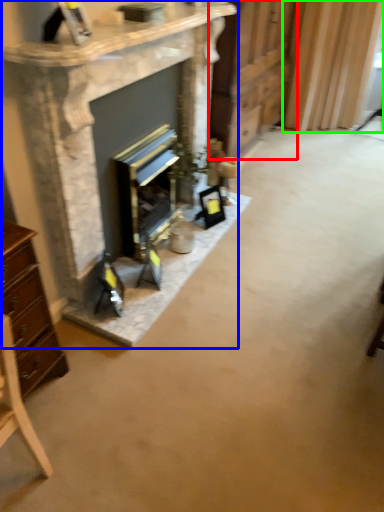
Question: Estimate the real-world distances between objects in this image. Which object is closer to dresser (highlighted by a red box), fireplace (highlighted by a blue box) or curtain (highlighted by a green box)?

Choices:
 (A) fireplace
 (B) curtain

Answer: (B)